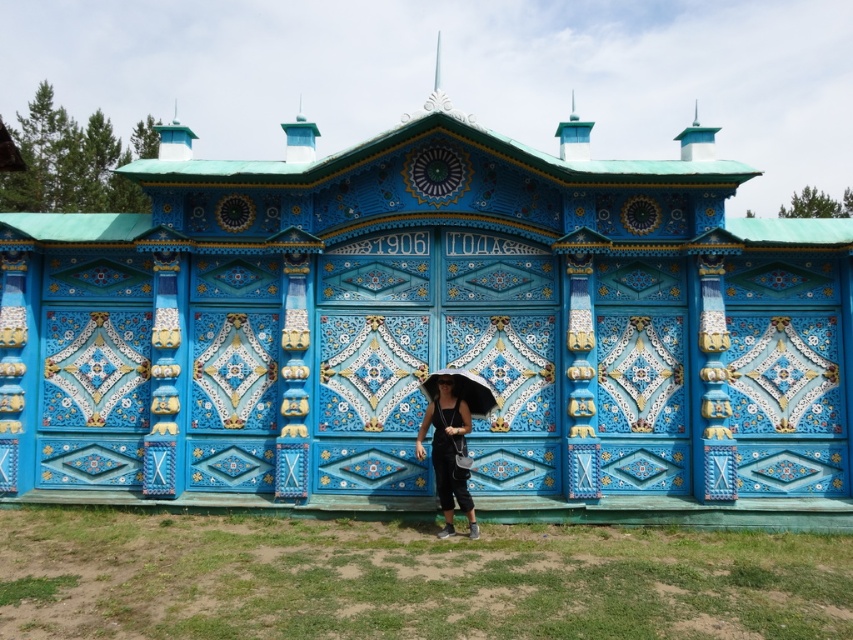
Is matte black hat at center positioned behind white matte umbrella at center?

No, it is not.

Is point (451, 435) positioned behind point (468, 394)?

No.

At what (x,y) coordinates should I click in order to perform the action: click on matte black hat at center. Please return your answer as a coordinate pair (x, y). Looking at the image, I should click on (448, 445).